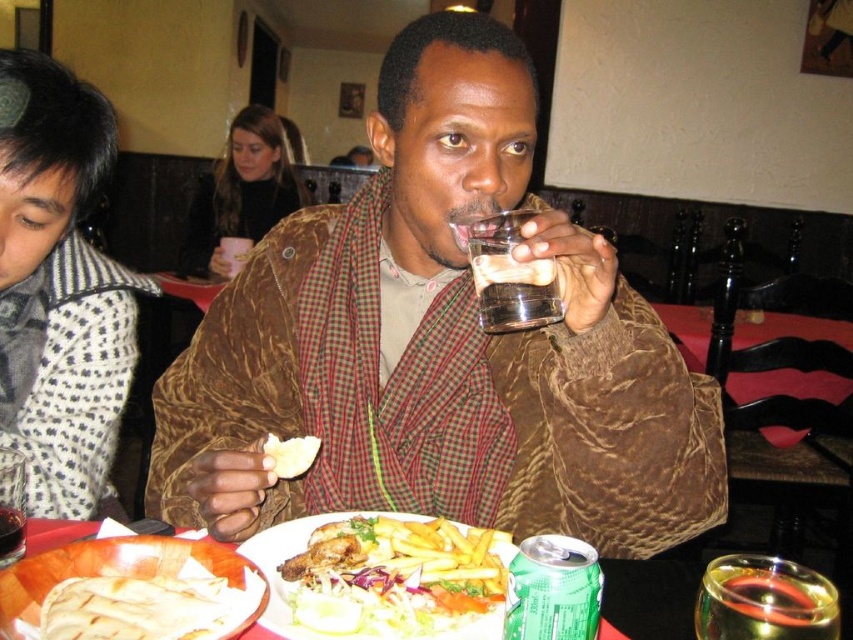
You are a photographer taking a picture of the patterned fabric shirt at left and the golden crispy fries at center. Which object should you focus on first to ensure both are in sharp focus?

The patterned fabric shirt at left is further to the viewer than the golden crispy fries at center, so you should focus on the patterned fabric shirt at left first to ensure both are in sharp focus.

What object is located at the coordinates point (241, 192) in the image?

The point (241, 192) corresponds to the black sweater at upper center.